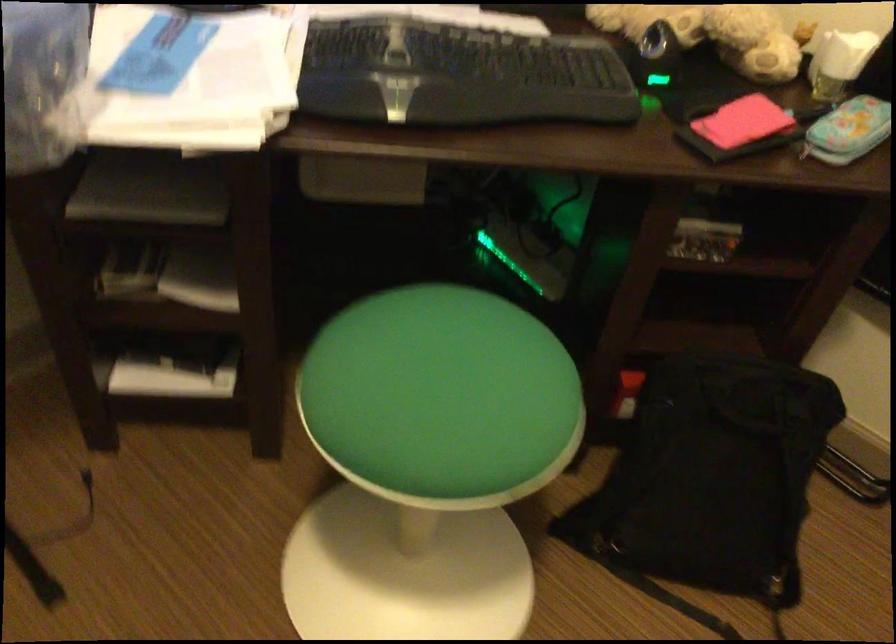
Describe the element at coordinates (640, 580) in the screenshot. I see `the black backpack strap` at that location.